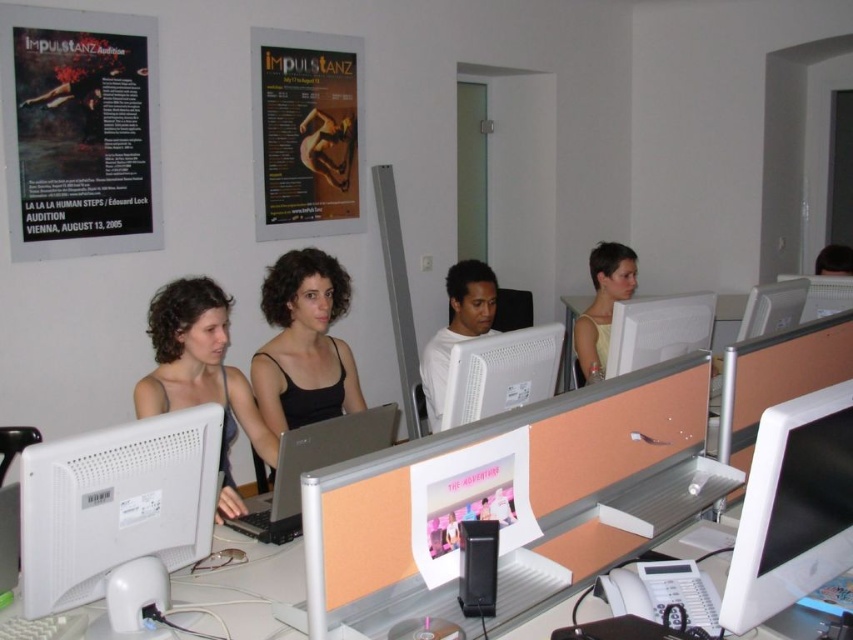
Question: Which point is farther to the camera?

Choices:
 (A) white plastic monitor at lower left
 (B) matte black tank top at center

Answer: (B)

Question: Is matte paper poster at upper center to the left of white glossy monitor at upper right from the viewer's perspective?

Choices:
 (A) yes
 (B) no

Answer: (A)

Question: Is black paper poster at upper left closer to camera compared to white matte shirt at center?

Choices:
 (A) no
 (B) yes

Answer: (A)

Question: Can you confirm if white plastic monitor at lower left is positioned to the right of matte paper poster at upper center?

Choices:
 (A) yes
 (B) no

Answer: (B)

Question: Among these objects, which one is farthest from the camera?

Choices:
 (A) matte black tank top at center
 (B) white plastic monitor at lower left

Answer: (A)

Question: Which object is farther from the camera taking this photo?

Choices:
 (A) black matte tank top at center
 (B) white glossy monitor at upper right
 (C) white glossy monitor at center
 (D) white plastic monitor at center

Answer: (B)